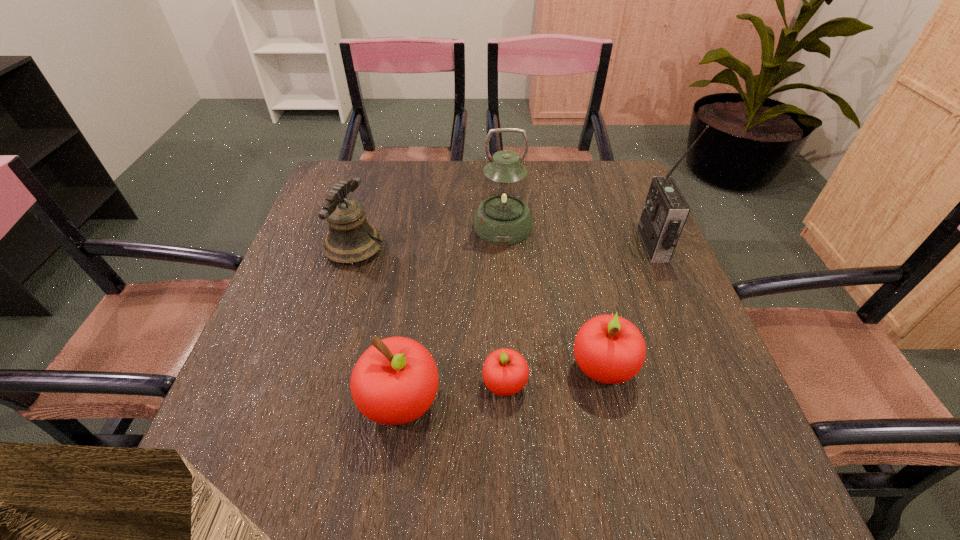
Please point a vacant point for placing a apple on the right. Please provide its 2D coordinates. Your answer should be formatted as a tuple, i.e. [(x, y)], where the tuple contains the x and y coordinates of a point satisfying the conditions above.

[(694, 352)]